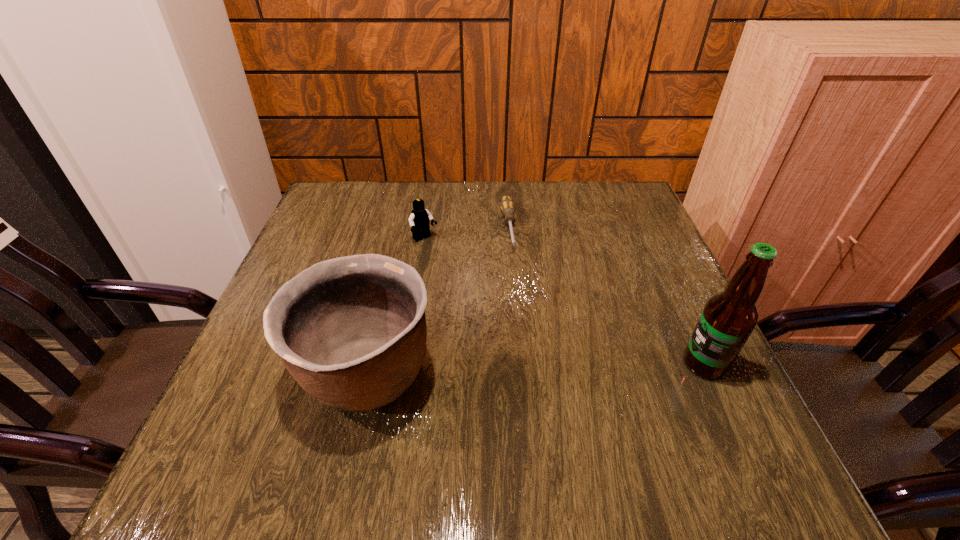
The height and width of the screenshot is (540, 960). Identify the location of the second tallest object. (351, 330).

Locate an element on the screen. The image size is (960, 540). the rightmost object is located at coordinates (728, 318).

Find the location of a particular element. The width and height of the screenshot is (960, 540). the tallest object is located at coordinates (728, 318).

The height and width of the screenshot is (540, 960). Identify the location of the shortest object. (507, 205).

This screenshot has height=540, width=960. Identify the location of screwdriver. (507, 205).

Where is `the third tallest object`? This screenshot has width=960, height=540. the third tallest object is located at coordinates (419, 220).

Where is `blank space located 0.090m on the right of the third shortest object`? blank space located 0.090m on the right of the third shortest object is located at coordinates (484, 374).

Locate an element on the screen. This screenshot has height=540, width=960. free space located 0.050m on the label of the rightmost object is located at coordinates (657, 364).

Find the location of a particular element. The height and width of the screenshot is (540, 960). vacant region located on the label of the rightmost object is located at coordinates (631, 364).

At what (x,y) coordinates should I click in order to perform the action: click on free space located on the label of the rightmost object. Please return your answer as a coordinate pair (x, y). Looking at the image, I should click on (552, 364).